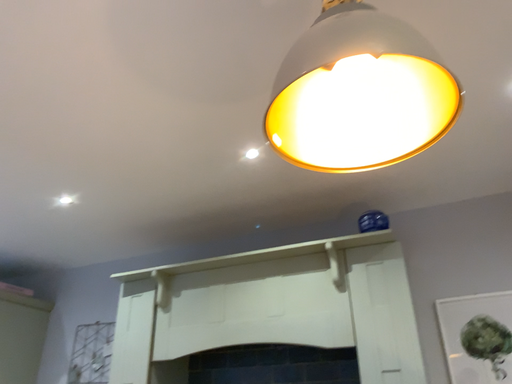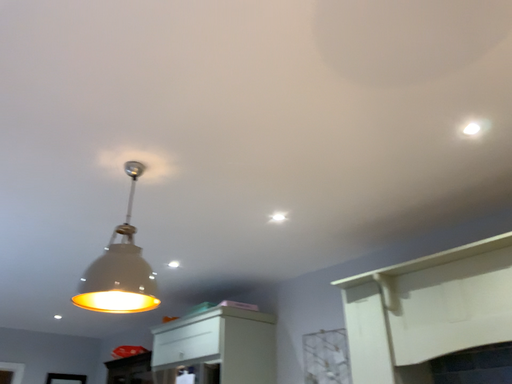
Question: How did the camera likely rotate when shooting the video?

Choices:
 (A) rotated right
 (B) rotated left

Answer: (B)